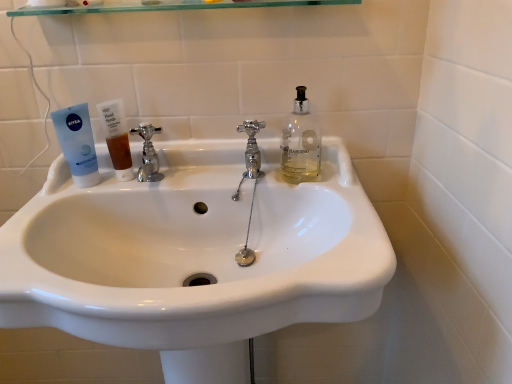
Question: Considering the relative sizes of white glossy sink at center and translucent amber liquid at sink left in the image provided, is white glossy sink at center wider than translucent amber liquid at sink left?

Choices:
 (A) yes
 (B) no

Answer: (A)

Question: Could you tell me if white glossy sink at center is facing translucent amber liquid at sink left?

Choices:
 (A) no
 (B) yes

Answer: (A)

Question: Considering the relative sizes of white glossy sink at center and translucent amber liquid at sink left in the image provided, is white glossy sink at center bigger than translucent amber liquid at sink left?

Choices:
 (A) yes
 (B) no

Answer: (A)

Question: From the image's perspective, is white glossy sink at center above translucent amber liquid at sink left?

Choices:
 (A) no
 (B) yes

Answer: (A)

Question: Does white glossy sink at center lie in front of translucent amber liquid at sink left?

Choices:
 (A) yes
 (B) no

Answer: (A)

Question: Is white glossy sink at center not near translucent amber liquid at sink left?

Choices:
 (A) no
 (B) yes

Answer: (A)

Question: Are white glossy sink at center and chrome/metallic faucet at center, the first tap in the right-to-left sequence, making contact?

Choices:
 (A) no
 (B) yes

Answer: (A)

Question: Can you confirm if white glossy sink at center is wider than chrome/metallic faucet at center, the first tap in the right-to-left sequence?

Choices:
 (A) no
 (B) yes

Answer: (B)

Question: Is white glossy sink at center positioned with its back to chrome/metallic faucet at center, the first tap in the right-to-left sequence?

Choices:
 (A) yes
 (B) no

Answer: (B)

Question: Does white glossy sink at center lie behind chrome/metallic faucet at center, the second tap when ordered from left to right?

Choices:
 (A) no
 (B) yes

Answer: (A)

Question: Can you confirm if white glossy sink at center is positioned to the right of chrome/metallic faucet at center, the first tap in the right-to-left sequence?

Choices:
 (A) no
 (B) yes

Answer: (A)

Question: Considering the relative sizes of white glossy sink at center and chrome/metallic faucet at center, the second tap when ordered from left to right, in the image provided, is white glossy sink at center taller than chrome/metallic faucet at center, the second tap when ordered from left to right,?

Choices:
 (A) no
 (B) yes

Answer: (B)

Question: From the image's perspective, does transparent glass shelf at upper center appear lower than chrome metallic faucet at center left, placed as the second tap when sorted from right to left?

Choices:
 (A) no
 (B) yes

Answer: (A)